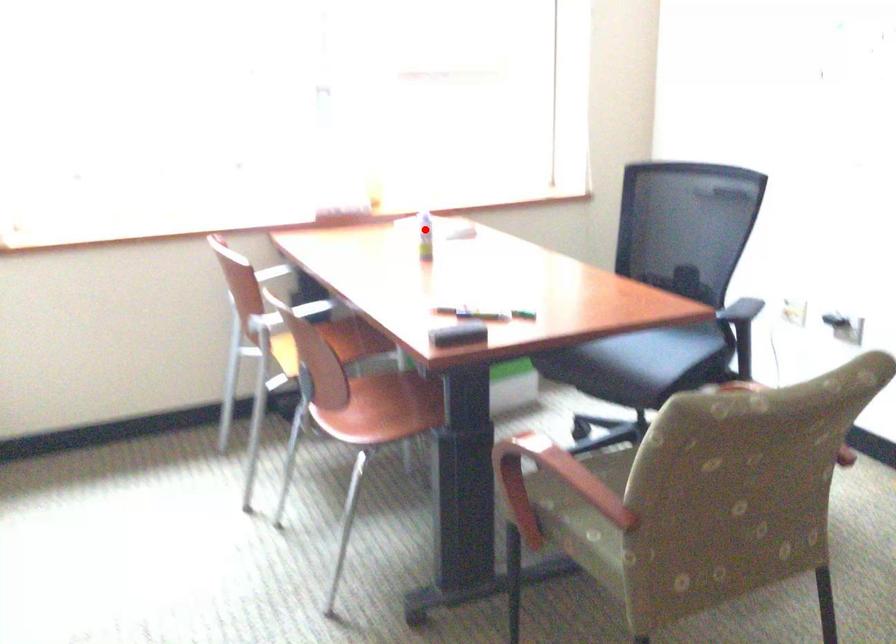
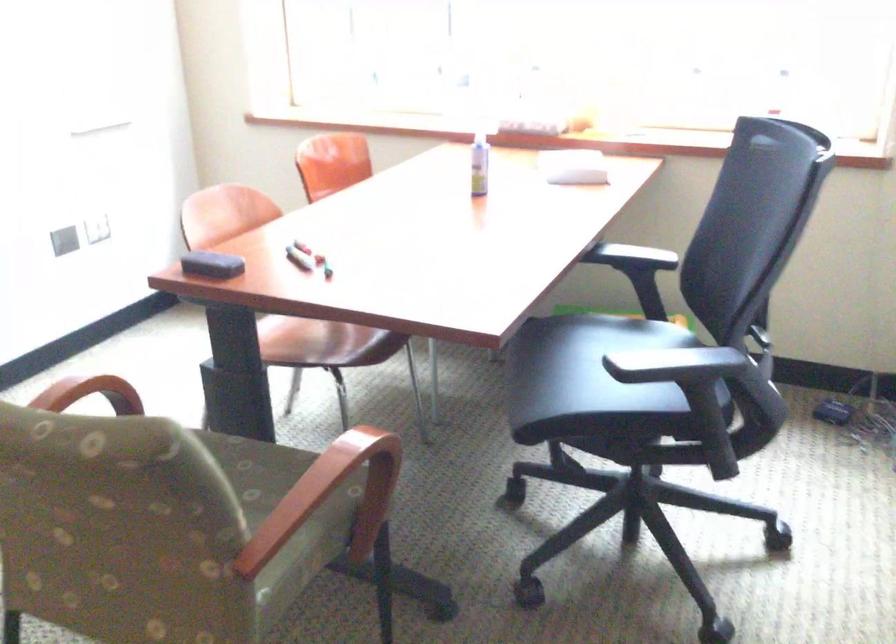
In the second image, find the point that corresponds to the highlighted location in the first image.

(478, 164)